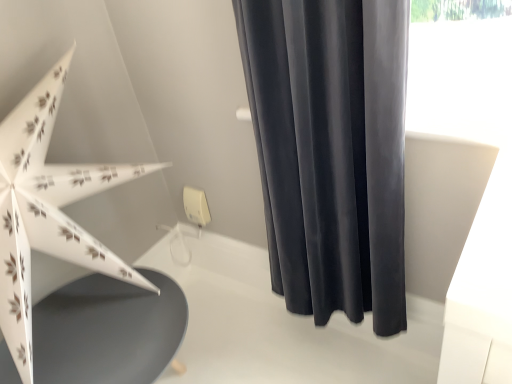
Measure the distance between point (148, 351) and camera.

Point (148, 351) is 95.80 centimeters away from camera.

This screenshot has height=384, width=512. Describe the element at coordinates (331, 151) in the screenshot. I see `dark gray velvet curtain at upper right` at that location.

Where is `matte gray table at lower left`? matte gray table at lower left is located at coordinates (108, 330).

Is point (96, 276) closer to viewer compared to point (372, 168)?

No, (96, 276) is further to viewer.

Which is correct: matte gray table at lower left is inside dark gray velvet curtain at upper right, or outside of it?

matte gray table at lower left exists outside the volume of dark gray velvet curtain at upper right.

Can you confirm if matte gray table at lower left is taller than dark gray velvet curtain at upper right?

In fact, matte gray table at lower left may be shorter than dark gray velvet curtain at upper right.

From the image's perspective, which one is positioned higher, white paper umbrella at left or matte gray table at lower left?

white paper umbrella at left, from the image's perspective.

What's the angular difference between white paper umbrella at left and matte gray table at lower left's facing directions?

The facing directions of white paper umbrella at left and matte gray table at lower left are 2.12 degrees apart.

From a real-world perspective, between white paper umbrella at left and matte gray table at lower left, who is vertically lower?

matte gray table at lower left.

Considering the relative positions of matte gray table at lower left and white paper umbrella at left in the image provided, is matte gray table at lower left to the left or to the right of white paper umbrella at left?

Based on their positions, matte gray table at lower left is located to the right of white paper umbrella at left.

What's the angular difference between matte gray table at lower left and white paper umbrella at left's facing directions?

The angle between the facing direction of matte gray table at lower left and the facing direction of white paper umbrella at left is 2.12 degrees.

From a real-world perspective, between matte gray table at lower left and white paper umbrella at left, who is vertically lower?

matte gray table at lower left.

Locate an element on the screen. umbrella on the left of matte gray table at lower left is located at coordinates (47, 210).

From the image's perspective, which one is positioned lower, white paper umbrella at left or dark gray velvet curtain at upper right?

white paper umbrella at left is shown below in the image.

Image resolution: width=512 pixels, height=384 pixels. In order to click on curtain directly beneath the white paper umbrella at left (from a real-world perspective) in this screenshot , I will do `click(331, 151)`.

Is dark gray velvet curtain at upper right at the back of white paper umbrella at left?

No, white paper umbrella at left is not facing away from dark gray velvet curtain at upper right.

Which point is more forward, (28,382) or (356,212)?

The point (28,382) is closer.

Between dark gray velvet curtain at upper right and matte gray table at lower left, which one has less height?

matte gray table at lower left is shorter.

Which object is thinner, dark gray velvet curtain at upper right or matte gray table at lower left?

Thinner between the two is dark gray velvet curtain at upper right.

Which object is more forward, dark gray velvet curtain at upper right or matte gray table at lower left?

dark gray velvet curtain at upper right is more forward.

Is dark gray velvet curtain at upper right looking in the opposite direction of matte gray table at lower left?

No, dark gray velvet curtain at upper right is not facing the opposite direction of matte gray table at lower left.

Is point (325, 261) farther from camera compared to point (97, 171)?

Yes, point (325, 261) is behind point (97, 171).

Is dark gray velvet curtain at upper right positioned with its back to white paper umbrella at left?

No, dark gray velvet curtain at upper right's orientation is not away from white paper umbrella at left.

Considering the positions of objects dark gray velvet curtain at upper right and white paper umbrella at left in the image provided, who is more to the right, dark gray velvet curtain at upper right or white paper umbrella at left?

Positioned to the right is dark gray velvet curtain at upper right.

Which is in front, dark gray velvet curtain at upper right or white paper umbrella at left?

white paper umbrella at left is closer to the camera.

I want to click on round table below the dark gray velvet curtain at upper right (from the image's perspective), so click(108, 330).

In the image, there is a white paper umbrella at left. Where is `round table below it (from a real-world perspective)`? This screenshot has width=512, height=384. round table below it (from a real-world perspective) is located at coordinates (108, 330).

Estimate the real-world distances between objects in this image. Which object is closer to white paper umbrella at left, dark gray velvet curtain at upper right or matte gray table at lower left?

matte gray table at lower left lies closer to white paper umbrella at left than the other object.

Based on their spatial positions, is dark gray velvet curtain at upper right or white paper umbrella at left closer to matte gray table at lower left?

white paper umbrella at left is closer to matte gray table at lower left.

From the image, which object appears to be nearer to dark gray velvet curtain at upper right, white paper umbrella at left or matte gray table at lower left?

Based on the image, white paper umbrella at left appears to be nearer to dark gray velvet curtain at upper right.

Based on their spatial positions, is white paper umbrella at left or dark gray velvet curtain at upper right closer to matte gray table at lower left?

white paper umbrella at left.

When comparing their distances from dark gray velvet curtain at upper right, does matte gray table at lower left or white paper umbrella at left seem further?

matte gray table at lower left is further to dark gray velvet curtain at upper right.

When comparing their distances from white paper umbrella at left, does matte gray table at lower left or dark gray velvet curtain at upper right seem closer?

matte gray table at lower left lies closer to white paper umbrella at left than the other object.

Locate an element on the screen. The image size is (512, 384). round table situated between white paper umbrella at left and dark gray velvet curtain at upper right from left to right is located at coordinates (108, 330).